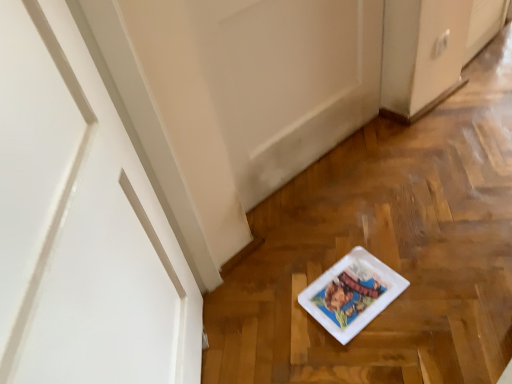
Locate an element on the screen. The width and height of the screenshot is (512, 384). vacant area that lies to the right of white glossy platter at center is located at coordinates (424, 272).